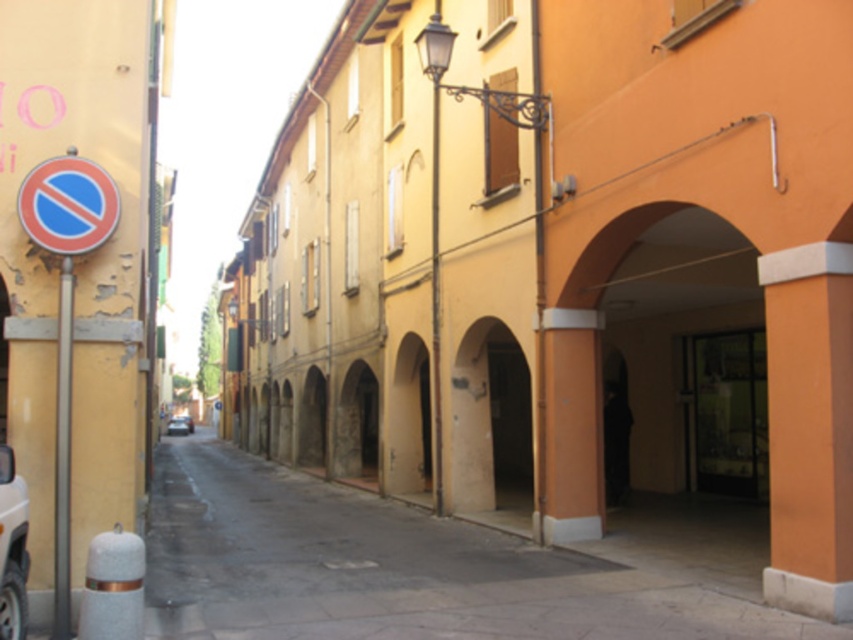
Question: Does blue plastic circle at upper left appear on the right side of metallic silver car at center?

Choices:
 (A) yes
 (B) no

Answer: (A)

Question: Can you confirm if white matte car at lower left is thinner than metallic silver car at center?

Choices:
 (A) yes
 (B) no

Answer: (A)

Question: Is orange matte pillar at right to the left of white matte car at lower left from the viewer's perspective?

Choices:
 (A) no
 (B) yes

Answer: (A)

Question: Which object is closer to the camera taking this photo?

Choices:
 (A) orange matte pillar at right
 (B) blue plastic circle at upper left
 (C) white matte car at lower left

Answer: (C)

Question: Which of the following is the farthest from the observer?

Choices:
 (A) (173, 420)
 (B) (90, 237)

Answer: (A)

Question: Which point is closer to the camera taking this photo?

Choices:
 (A) coord(813,481)
 (B) coord(24,484)
 (C) coord(173,422)

Answer: (B)